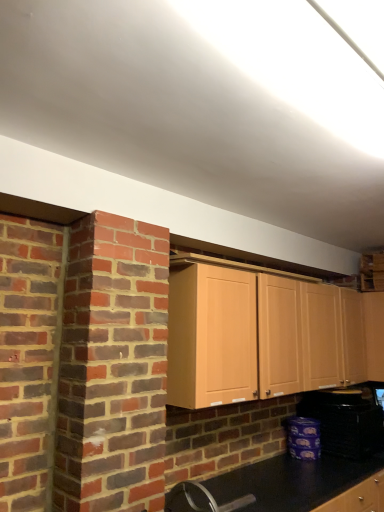
This screenshot has height=512, width=384. Describe the element at coordinates (345, 422) in the screenshot. I see `black plastic toaster at lower right` at that location.

This screenshot has width=384, height=512. I want to click on black plastic toaster at lower right, so 345,422.

Image resolution: width=384 pixels, height=512 pixels. Describe the element at coordinates (258, 336) in the screenshot. I see `light wood cabinet at center` at that location.

This screenshot has height=512, width=384. I want to click on light wood cabinet at center, so click(258, 336).

You are a GUI agent. You are given a task and a screenshot of the screen. Output one action in this format:
    pyautogui.click(x=<x>, y=<y>)
    Task: Click on the black plastic toaster at lower right
    The image size is (384, 512).
    Given the screenshot: What is the action you would take?
    pyautogui.click(x=345, y=422)

From the picture: Considering the relative positions of light wood cabinet at center and black plastic toaster at lower right in the image provided, is light wood cabinet at center to the right of black plastic toaster at lower right from the viewer's perspective?

Incorrect, light wood cabinet at center is not on the right side of black plastic toaster at lower right.

Which object is further away from the camera taking this photo, light wood cabinet at center or black plastic toaster at lower right?

black plastic toaster at lower right.

Between point (215, 321) and point (377, 437), which one is positioned behind?

The point (377, 437) is behind.

From the image's perspective, is light wood cabinet at center located above or below black plastic toaster at lower right?

Clearly, from the image's perspective, light wood cabinet at center is above black plastic toaster at lower right.

From a real-world perspective, is light wood cabinet at center below black plastic toaster at lower right?

No, from a real-world perspective, light wood cabinet at center is not below black plastic toaster at lower right.

Which object is wider, light wood cabinet at center or black plastic toaster at lower right?

With larger width is black plastic toaster at lower right.

In terms of height, does light wood cabinet at center look taller or shorter compared to black plastic toaster at lower right?

light wood cabinet at center is taller than black plastic toaster at lower right.

Between light wood cabinet at center and black plastic toaster at lower right, which one has smaller size?

Smaller between the two is black plastic toaster at lower right.

Can we say light wood cabinet at center lies outside black plastic toaster at lower right?

light wood cabinet at center lies outside black plastic toaster at lower right's area.

Is light wood cabinet at center next to black plastic toaster at lower right?

No, light wood cabinet at center is not next to black plastic toaster at lower right.

Is black plastic toaster at lower right at the back of light wood cabinet at center?

No.

Can you tell me how much light wood cabinet at center and black plastic toaster at lower right differ in facing direction?

The facing directions of light wood cabinet at center and black plastic toaster at lower right are 0.364 degrees apart.

Find the location of `appliance that appears behind the light wood cabinet at center`. appliance that appears behind the light wood cabinet at center is located at coordinates (345, 422).

Is black plastic toaster at lower right to the left of light wood cabinet at center from the viewer's perspective?

Incorrect, black plastic toaster at lower right is not on the left side of light wood cabinet at center.

Which is behind, black plastic toaster at lower right or light wood cabinet at center?

Positioned behind is black plastic toaster at lower right.

Is point (352, 436) positioned in front of point (237, 355)?

No, (352, 436) is further to viewer.

From the image's perspective, is black plastic toaster at lower right beneath light wood cabinet at center?

Correct, black plastic toaster at lower right appears lower than light wood cabinet at center in the image.

From a real-world perspective, is black plastic toaster at lower right under light wood cabinet at center?

Indeed, from a real-world perspective, black plastic toaster at lower right is positioned beneath light wood cabinet at center.

Which object is thinner, black plastic toaster at lower right or light wood cabinet at center?

light wood cabinet at center is thinner.

Considering the sizes of objects black plastic toaster at lower right and light wood cabinet at center in the image provided, who is taller, black plastic toaster at lower right or light wood cabinet at center?

light wood cabinet at center is taller.

Is black plastic toaster at lower right bigger or smaller than light wood cabinet at center?

black plastic toaster at lower right is smaller than light wood cabinet at center.

Looking at this image, is black plastic toaster at lower right outside of light wood cabinet at center?

Yes, black plastic toaster at lower right is not within light wood cabinet at center.

Is there a large distance between black plastic toaster at lower right and light wood cabinet at center?

No.

Is light wood cabinet at center at the back of black plastic toaster at lower right?

No, black plastic toaster at lower right is not facing the opposite direction of light wood cabinet at center.

Can you tell me how much black plastic toaster at lower right and light wood cabinet at center differ in facing direction?

The angle between the facing direction of black plastic toaster at lower right and the facing direction of light wood cabinet at center is 0.364 degrees.

You are a GUI agent. You are given a task and a screenshot of the screen. Output one action in this format:
    pyautogui.click(x=<x>, y=<y>)
    Task: Click on the cabinetry located on the left of black plastic toaster at lower right
    Image resolution: width=384 pixels, height=512 pixels.
    Given the screenshot: What is the action you would take?
    258,336

In the image, there is a light wood cabinet at center. Identify the location of appliance below it (from a real-world perspective). This screenshot has width=384, height=512. (345, 422).

The width and height of the screenshot is (384, 512). I want to click on cabinetry located on the left of black plastic toaster at lower right, so click(258, 336).